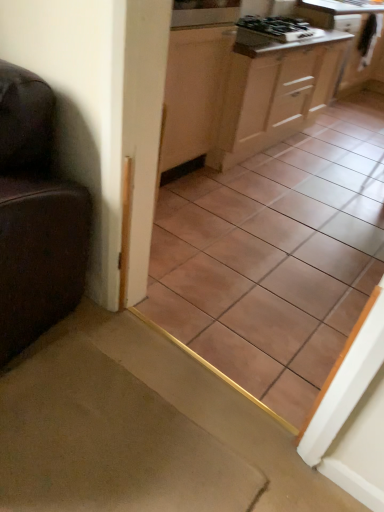
Question: Does brown ceramic tile at center contain black glossy gas stove at upper center?

Choices:
 (A) no
 (B) yes

Answer: (A)

Question: Are brown ceramic tile at center and black glossy gas stove at upper center located far from each other?

Choices:
 (A) yes
 (B) no

Answer: (A)

Question: Is brown ceramic tile at center shorter than black glossy gas stove at upper center?

Choices:
 (A) yes
 (B) no

Answer: (B)

Question: Considering the relative sizes of brown ceramic tile at center and black glossy gas stove at upper center in the image provided, is brown ceramic tile at center wider than black glossy gas stove at upper center?

Choices:
 (A) no
 (B) yes

Answer: (A)

Question: From the image's perspective, is brown ceramic tile at center beneath black glossy gas stove at upper center?

Choices:
 (A) no
 (B) yes

Answer: (B)

Question: Is brown ceramic tile at center next to black glossy gas stove at upper center?

Choices:
 (A) yes
 (B) no

Answer: (B)

Question: Can you confirm if black glossy gas stove at upper center is shorter than white glossy countertop at upper right?

Choices:
 (A) yes
 (B) no

Answer: (A)

Question: Can you confirm if black glossy gas stove at upper center is positioned to the right of white glossy countertop at upper right?

Choices:
 (A) yes
 (B) no

Answer: (B)

Question: Is black glossy gas stove at upper center not near white glossy countertop at upper right?

Choices:
 (A) yes
 (B) no

Answer: (B)

Question: Does black glossy gas stove at upper center lie behind white glossy countertop at upper right?

Choices:
 (A) yes
 (B) no

Answer: (B)

Question: Considering the relative sizes of black glossy gas stove at upper center and white glossy countertop at upper right in the image provided, is black glossy gas stove at upper center wider than white glossy countertop at upper right?

Choices:
 (A) yes
 (B) no

Answer: (B)

Question: Does black glossy gas stove at upper center have a greater height compared to white glossy countertop at upper right?

Choices:
 (A) no
 (B) yes

Answer: (A)

Question: Is wooden cabinet at upper right, the first cabinetry viewed from the back, outside carpet at lower left?

Choices:
 (A) no
 (B) yes

Answer: (B)